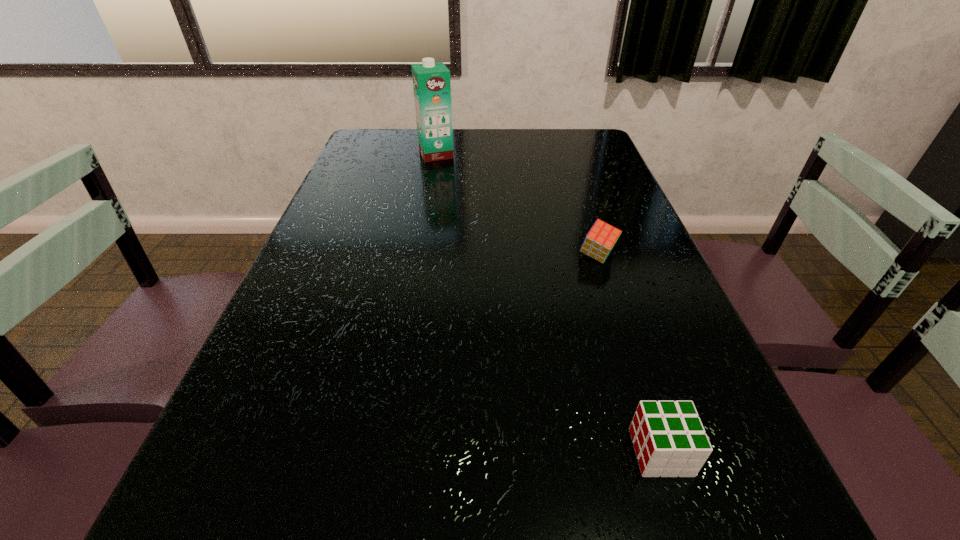
Where is `free space at the far edge`? Image resolution: width=960 pixels, height=540 pixels. free space at the far edge is located at coordinates (492, 146).

In the image, there is a desktop. What are the coordinates of `vacant region at the left edge` in the screenshot? It's located at (290, 428).

Locate an element on the screen. This screenshot has height=540, width=960. vacant area at the right edge is located at coordinates (599, 208).

Identify the location of vacant space at the far left corner. This screenshot has height=540, width=960. (407, 130).

Where is `vacant space at the far right corner of the desktop`? This screenshot has height=540, width=960. vacant space at the far right corner of the desktop is located at coordinates (577, 154).

Where is `free point between the nearer cube and the carton`? The image size is (960, 540). free point between the nearer cube and the carton is located at coordinates (x=548, y=303).

Find the location of a particular element. This screenshot has width=960, height=540. unoccupied area between the second nearest object and the nearest object is located at coordinates (629, 354).

This screenshot has height=540, width=960. I want to click on unoccupied area between the nearer cube and the second nearest object, so click(629, 354).

Identify the location of empty location between the second nearest object and the carton. (516, 205).

Locate an element on the screen. free space between the tallest object and the nearest object is located at coordinates (548, 303).